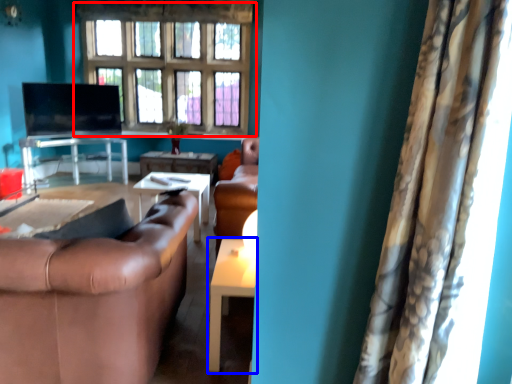
Question: Which point is further to the camera, window (highlighted by a red box) or table (highlighted by a blue box)?

Choices:
 (A) window
 (B) table

Answer: (A)